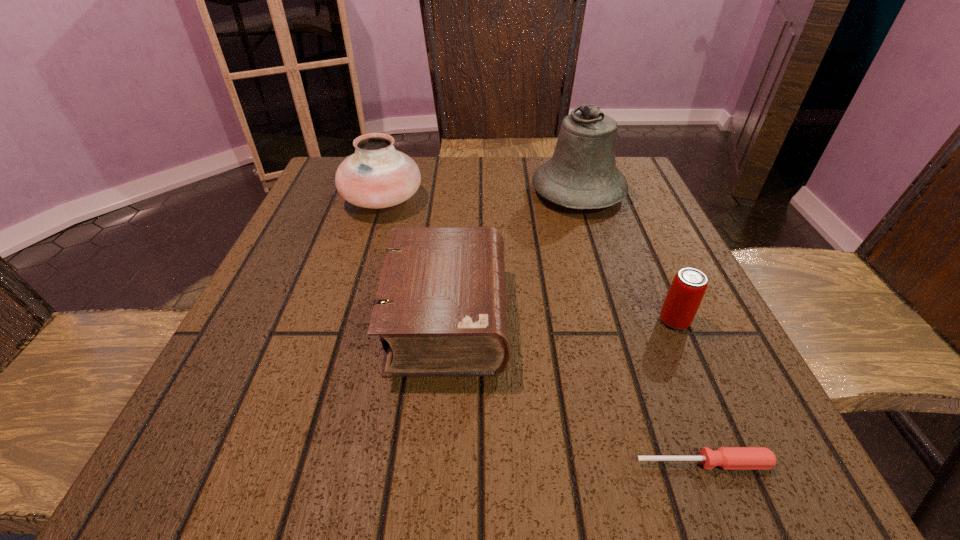
Identify which object is located as the fourth nearest to the beer can. Please provide its 2D coordinates. Your answer should be formatted as a tuple, i.e. [(x, y)], where the tuple contains the x and y coordinates of a point satisfying the conditions above.

[(377, 175)]

Identify the location of vacant region that satisfies the following two spatial constraints: 1. on the spine side of the screwdriver; 2. on the right side of the Bible. (437, 463).

Identify the location of vacant space that satisfies the following two spatial constraints: 1. on the spine side of the Bible; 2. on the back side of the beer can. Image resolution: width=960 pixels, height=540 pixels. (447, 321).

This screenshot has width=960, height=540. What are the coordinates of `free space that satisfies the following two spatial constraints: 1. on the spine side of the Bible; 2. on the left side of the shortest object` in the screenshot? It's located at (437, 463).

You are a GUI agent. You are given a task and a screenshot of the screen. Output one action in this format:
    pyautogui.click(x=<x>, y=<y>)
    Task: Click on the vacant space that satisfies the following two spatial constraints: 1. on the back side of the bell; 2. on the right side of the pottery
    The width and height of the screenshot is (960, 540).
    Given the screenshot: What is the action you would take?
    pyautogui.click(x=384, y=193)